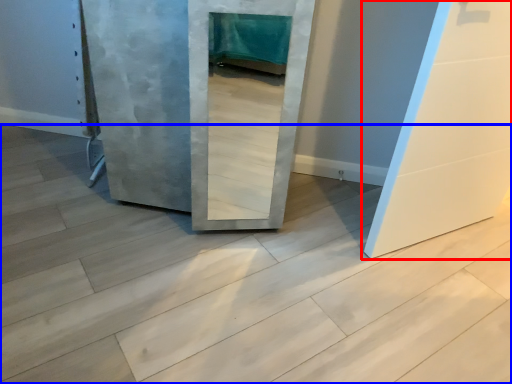
Question: Which object appears farthest to the camera in this image, door (highlighted by a red box) or concrete (highlighted by a blue box)?

Choices:
 (A) door
 (B) concrete

Answer: (A)